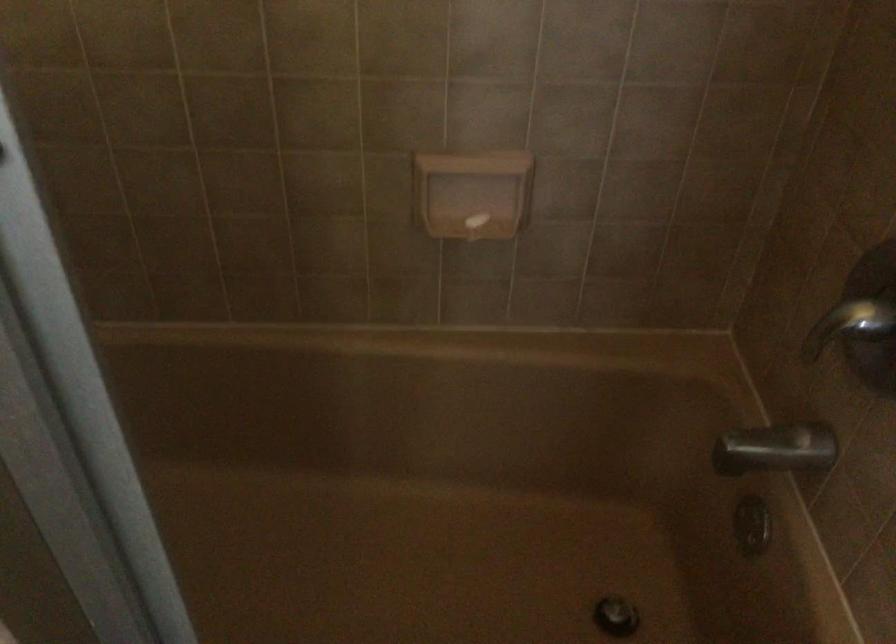
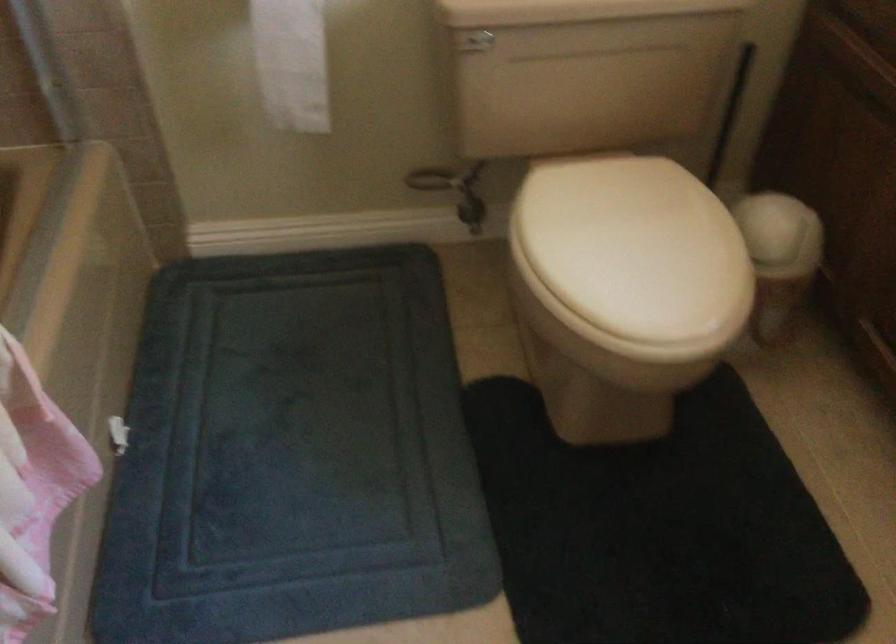
How did the camera likely rotate?

The rotation direction of the camera is right-down.